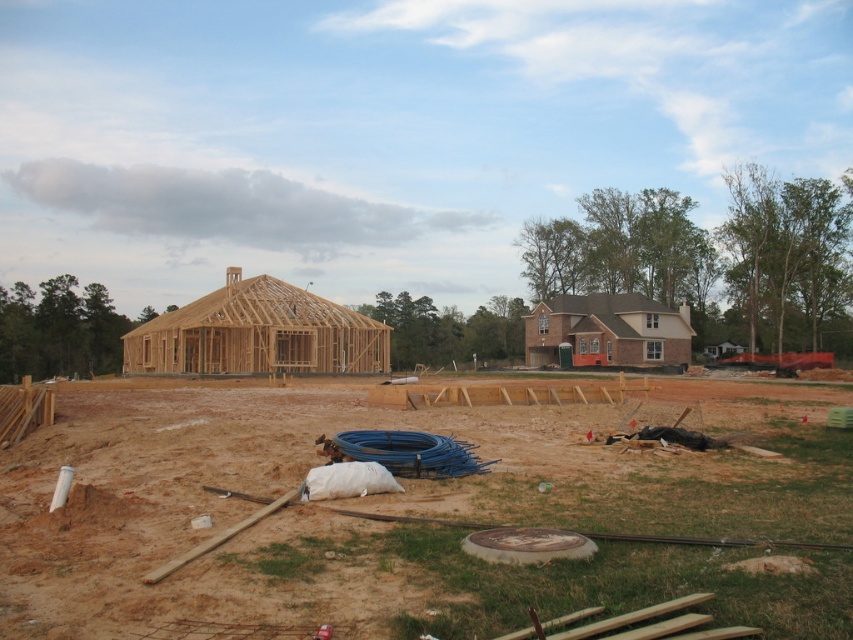
You are standing at the bottom center of the construction site where the manhole cover is located. You need to walk to the wooden frame house at center. In which direction should you move relative to your current position?

You should move north because the wooden frame house at center is located at point (257, 333), which is north of your current position at the manhole cover near the bottom center.